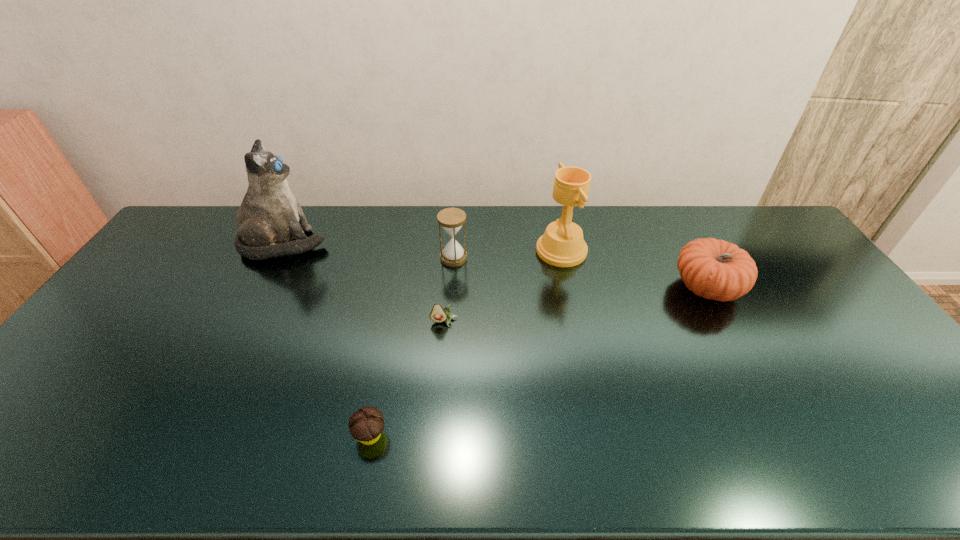
At what (x,y) coordinates should I click in order to perform the action: click on the leftmost object. Please return your answer as a coordinate pair (x, y). The image size is (960, 540). Looking at the image, I should click on (269, 217).

Where is `the tallest object`? Image resolution: width=960 pixels, height=540 pixels. the tallest object is located at coordinates (269, 217).

Find the location of `the second tallest object`. the second tallest object is located at coordinates tap(562, 245).

This screenshot has height=540, width=960. Find the location of `award`. award is located at coordinates (562, 245).

Find the location of a particular element. Image resolution: width=960 pixels, height=540 pixels. hourglass is located at coordinates (451, 219).

Image resolution: width=960 pixels, height=540 pixels. Identify the location of the third shortest object. (713, 269).

Image resolution: width=960 pixels, height=540 pixels. In order to click on pumpkin in this screenshot , I will do `click(713, 269)`.

Identify the location of the fifth farthest object. This screenshot has height=540, width=960. (438, 314).

At what (x,y) coordinates should I click in order to perform the action: click on muffin. Please return your answer as a coordinate pair (x, y). Looking at the image, I should click on (365, 425).

Identify the location of the second object from left to right. Image resolution: width=960 pixels, height=540 pixels. (365, 425).